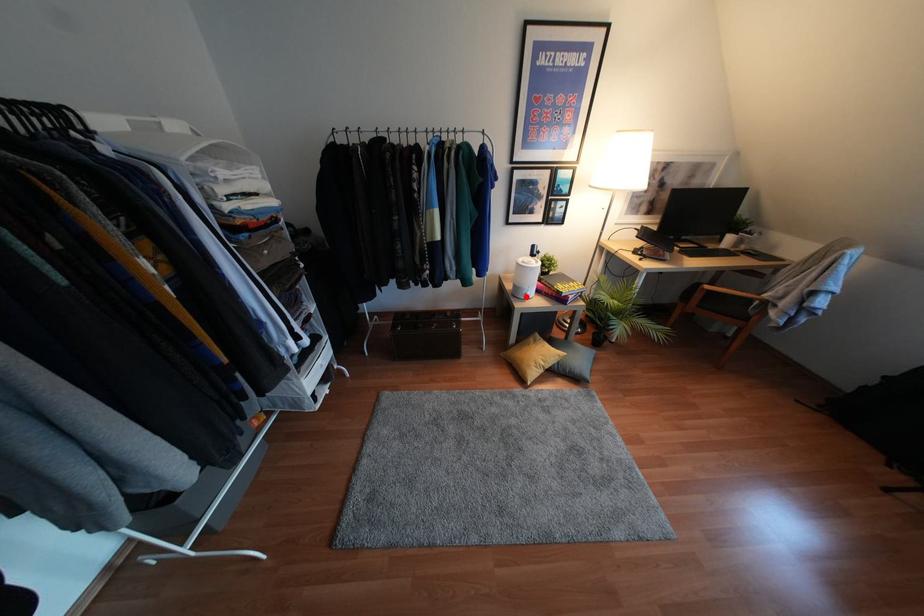
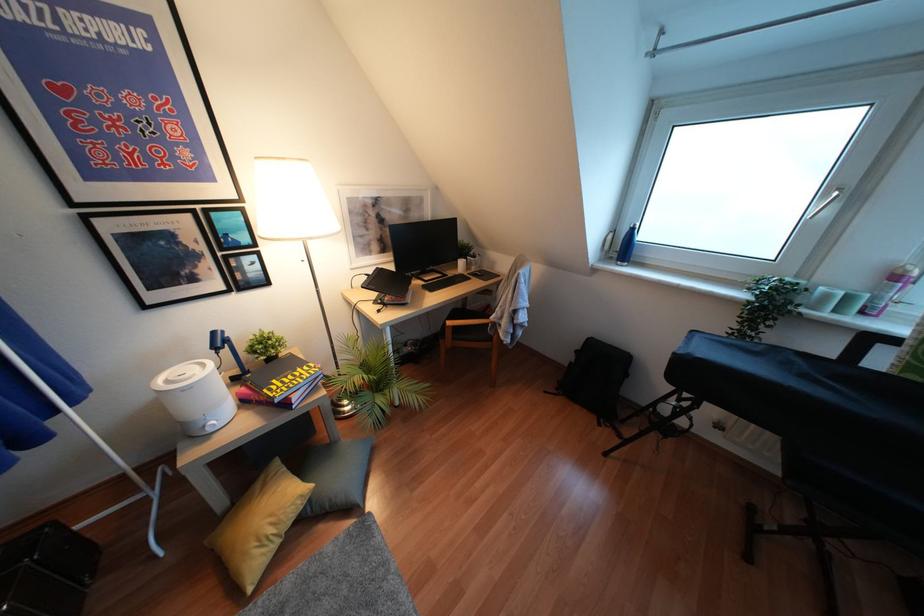
The point at the highlighted location is marked in the first image. Where is the corresponding point in the second image?

(210, 430)